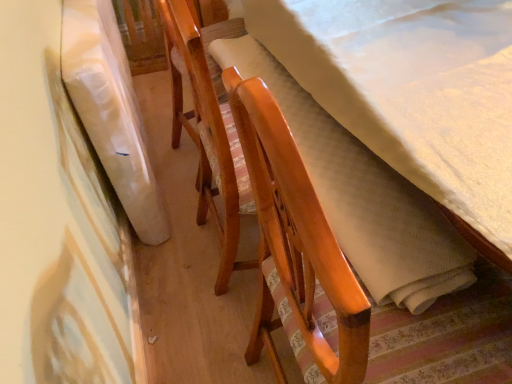
Question: Considering the positions of wooden chair with striped cushion at center and white fabric at left in the image, is wooden chair with striped cushion at center bigger or smaller than white fabric at left?

Choices:
 (A) big
 (B) small

Answer: (A)

Question: Does point (366, 327) appear closer or farther from the camera than point (79, 105)?

Choices:
 (A) closer
 (B) farther

Answer: (A)

Question: Considering the relative positions of wooden chair with striped cushion at center and white fabric at left in the image provided, is wooden chair with striped cushion at center to the left or to the right of white fabric at left?

Choices:
 (A) left
 (B) right

Answer: (B)

Question: From the image's perspective, is white fabric at left positioned above or below wooden chair with striped cushion at center?

Choices:
 (A) above
 (B) below

Answer: (A)

Question: Considering the positions of white fabric at left and wooden chair with striped cushion at center in the image, is white fabric at left wider or thinner than wooden chair with striped cushion at center?

Choices:
 (A) thin
 (B) wide

Answer: (A)

Question: Is white fabric at left to the left or to the right of wooden chair with striped cushion at center in the image?

Choices:
 (A) right
 (B) left

Answer: (B)

Question: Is white fabric at left spatially inside wooden chair with striped cushion at center, or outside of it?

Choices:
 (A) inside
 (B) outside

Answer: (B)